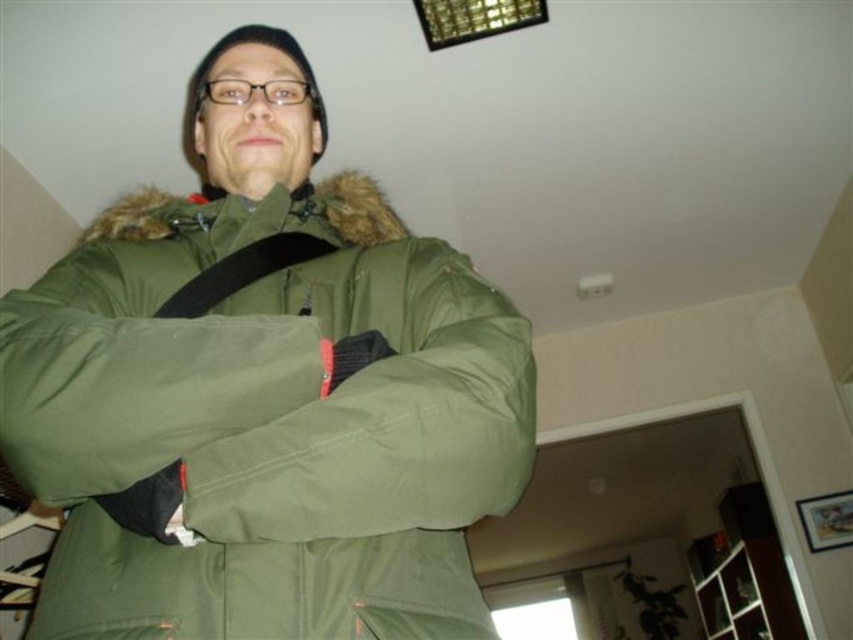
Does green matte jacket at center have a greater width compared to black fabric strap at center?

Yes.

Is green matte jacket at center below black fabric strap at center?

Correct, green matte jacket at center is located below black fabric strap at center.

Identify the location of green matte jacket at center. This screenshot has width=853, height=640. (267, 424).